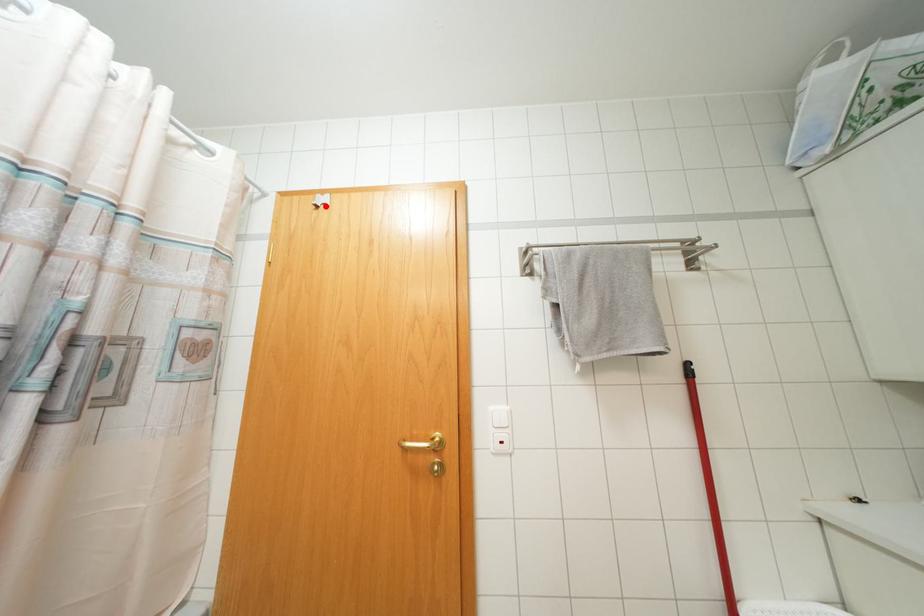
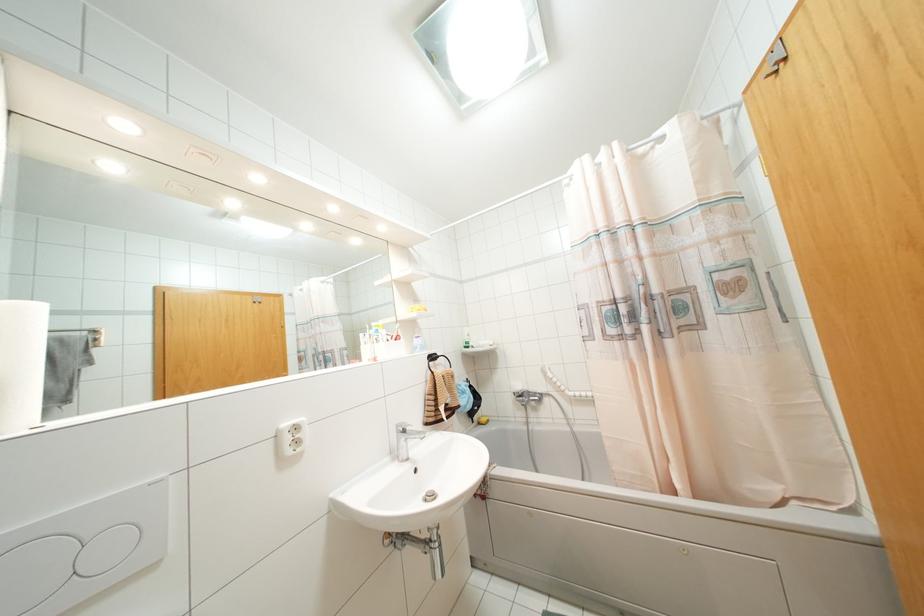
Find the pixel in the second image that matches the highlighted location in the first image.

(784, 58)